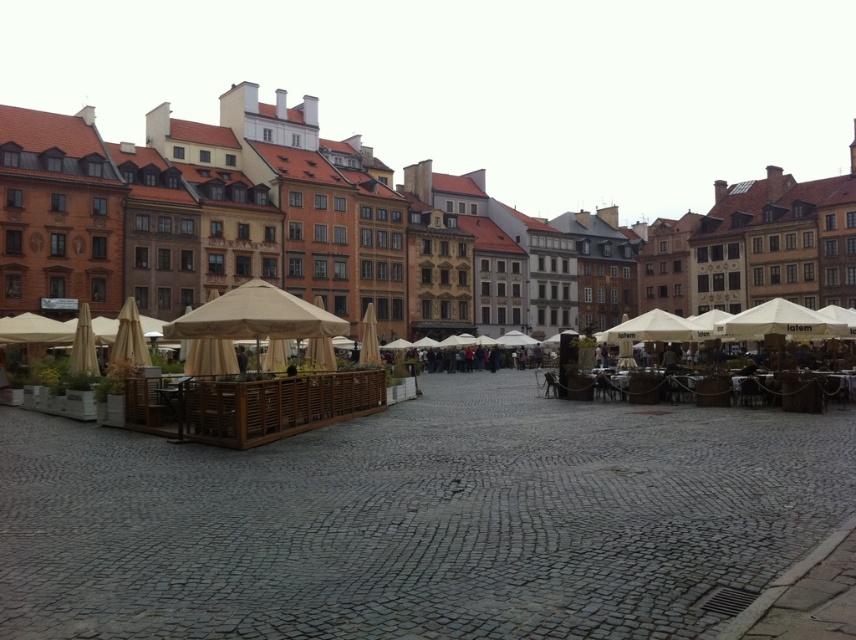
You are a painter setting up an easel in the cobblestone square. You need to choose between the beige fabric umbrellas at center and the white fabric canopy at right to place your easel under for shade. Which one offers a wider space to work under?

The beige fabric umbrellas at center offers a wider space to work under because its width is larger than the white fabric canopy at right.

You are a customer at a cafe in the square and want to sit under an umbrella that provides shade. The cafe has both beige fabric umbrellas at center and white fabric canopy at center. Which one is directly above the other?

The beige fabric umbrellas at center is positioned over white fabric canopy at center, so the beige one is directly above the white one.

You are standing at the point labeled point [272,212] in the cobblestone square. Looking around, you see beige fabric umbrellas at center. What is the closest object to your current position?

The closest object to your current position at point [272,212] is the beige fabric umbrellas at center, as the point indicates their location.